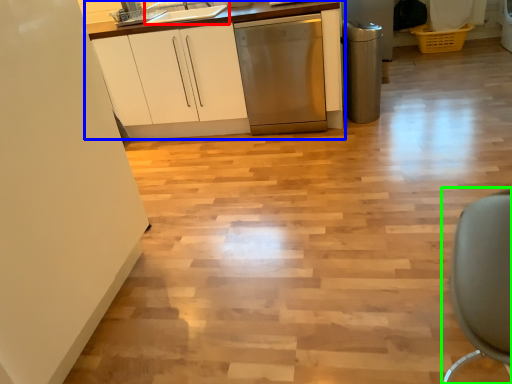
Question: Based on their relative distances, which object is nearer to sink (highlighted by a red box)? Choose from cabinetry (highlighted by a blue box) and swivel chair (highlighted by a green box).

Choices:
 (A) cabinetry
 (B) swivel chair

Answer: (A)